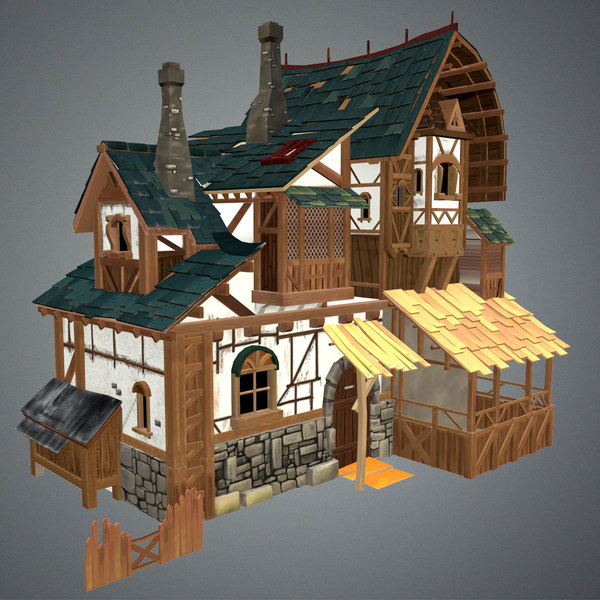
Image resolution: width=600 pixels, height=600 pixels. What are the coordinates of `door` in the screenshot? It's located at (338, 422).